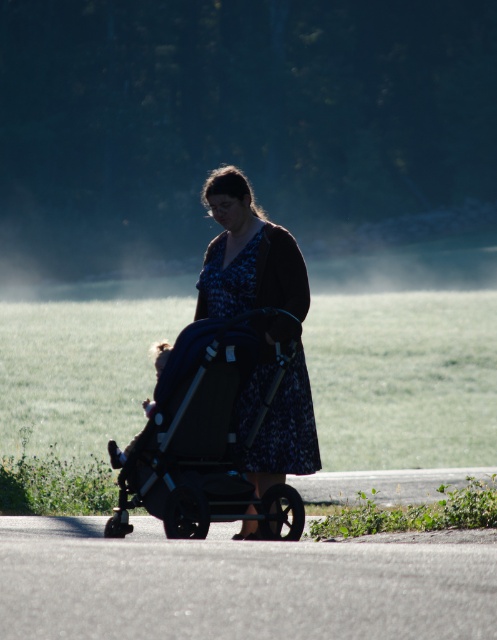
Question: Among these points, which one is farthest from the camera?

Choices:
 (A) (229, 301)
 (B) (395, 205)
 (C) (117, 464)
 (D) (268, 400)

Answer: (B)

Question: Is foggy mist at center closer to the viewer compared to white fluffy baby at center?

Choices:
 (A) no
 (B) yes

Answer: (A)

Question: Is matte black stroller at center thinner than white fluffy baby at center?

Choices:
 (A) yes
 (B) no

Answer: (A)

Question: Can you confirm if foggy mist at center is wider than matte black stroller at center?

Choices:
 (A) yes
 (B) no

Answer: (A)

Question: Among these points, which one is farthest from the camera?

Choices:
 (A) (263, 428)
 (B) (250, 67)
 (C) (166, 353)

Answer: (B)

Question: Which of these objects is positioned closest to the foggy mist at center?

Choices:
 (A) blue floral dress at center
 (B) matte black stroller at center
 (C) white fluffy baby at center

Answer: (A)